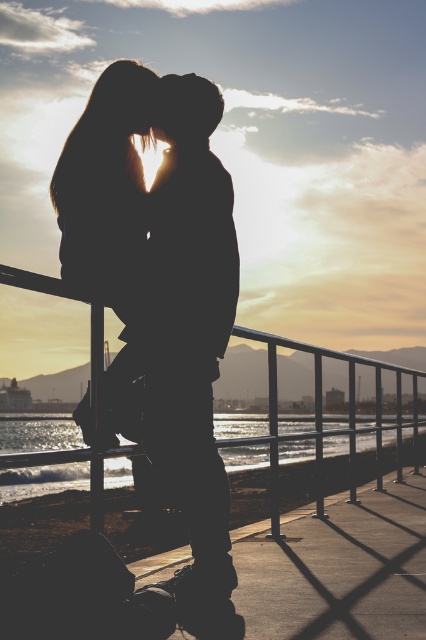
What are the coordinates of `silhouette figure at center` in the screenshot? It's located at (160, 276).

Between point (140, 321) and point (94, 529), which one is positioned in front?

Positioned in front is point (140, 321).

Where is `silhouette figure at center`? This screenshot has width=426, height=640. silhouette figure at center is located at coordinates (160, 276).

Looking at this image, does metallic silver rail at center appear on the left side of glistening water at lower left?

No, metallic silver rail at center is not to the left of glistening water at lower left.

What do you see at coordinates (322, 417) in the screenshot? The image size is (426, 640). I see `metallic silver rail at center` at bounding box center [322, 417].

You are a GUI agent. You are given a task and a screenshot of the screen. Output one action in this format:
    pyautogui.click(x=<x>, y=<y>)
    Task: Click on the metallic silver rail at center
    The height and width of the screenshot is (640, 426).
    Given the screenshot: What is the action you would take?
    pyautogui.click(x=322, y=417)

Consider the image. Who is shorter, silhouette figure at center or glistening water at lower left?

silhouette figure at center is shorter.

Where is `silhouette figure at center`? The image size is (426, 640). silhouette figure at center is located at coordinates (160, 276).

What do you see at coordinates (160, 276) in the screenshot? I see `silhouette figure at center` at bounding box center [160, 276].

Where is `silhouette figure at center`? Image resolution: width=426 pixels, height=640 pixels. silhouette figure at center is located at coordinates (160, 276).